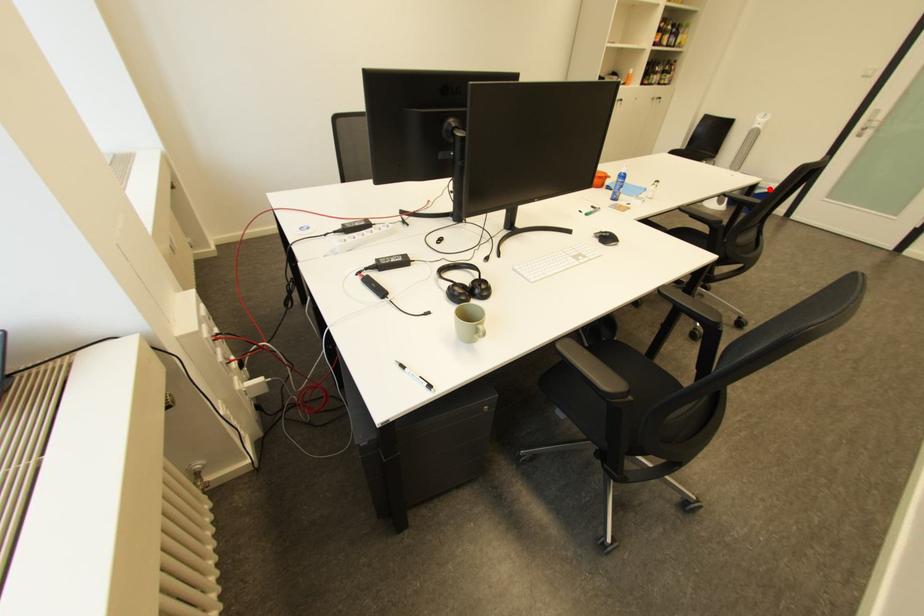
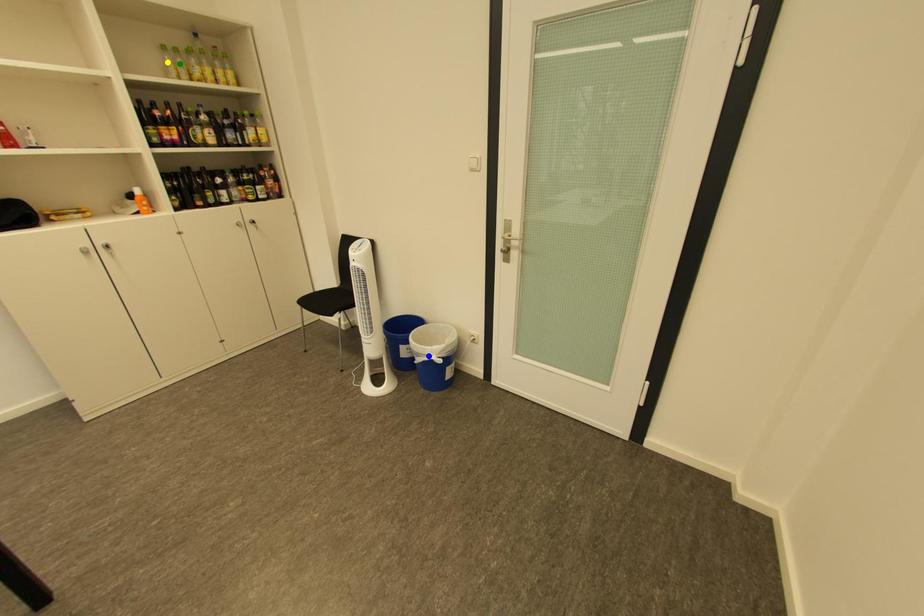
Question: I am providing you with two images of the same scene from different viewpoints. A red point is marked on the first image. You are given multiple points on the second image. Can you choose the point in image 2 that corresponds to the point in image 1?

Choices:
 (A) yellow point
 (B) green point
 (C) blue point

Answer: (C)